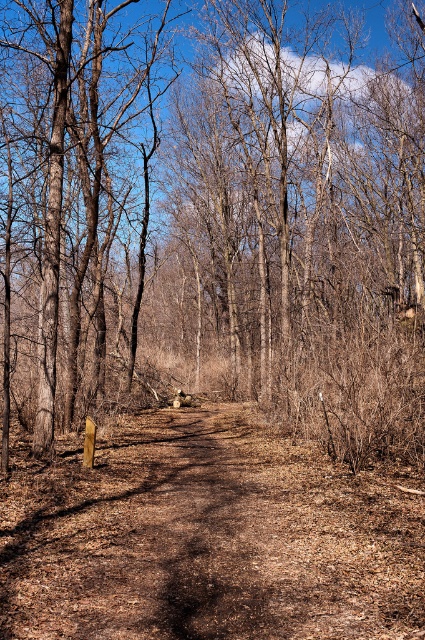
Question: Is brown dry leaves at center wider than brown dirt track at center?

Choices:
 (A) yes
 (B) no

Answer: (A)

Question: Which point is closer to the camera?

Choices:
 (A) brown rough tree at left
 (B) brown dirt track at center

Answer: (B)

Question: Which point is closer to the camera taking this photo?

Choices:
 (A) (289, 220)
 (B) (31, 45)
 (C) (95, 518)

Answer: (C)

Question: Which point appears closest to the camera in this image?

Choices:
 (A) (67, 102)
 (B) (257, 387)
 (C) (50, 632)

Answer: (C)

Question: Is brown dirt track at center smaller than brown rough tree at left?

Choices:
 (A) no
 (B) yes

Answer: (B)

Question: Does brown dirt track at center have a smaller size compared to brown rough tree at left?

Choices:
 (A) yes
 (B) no

Answer: (A)